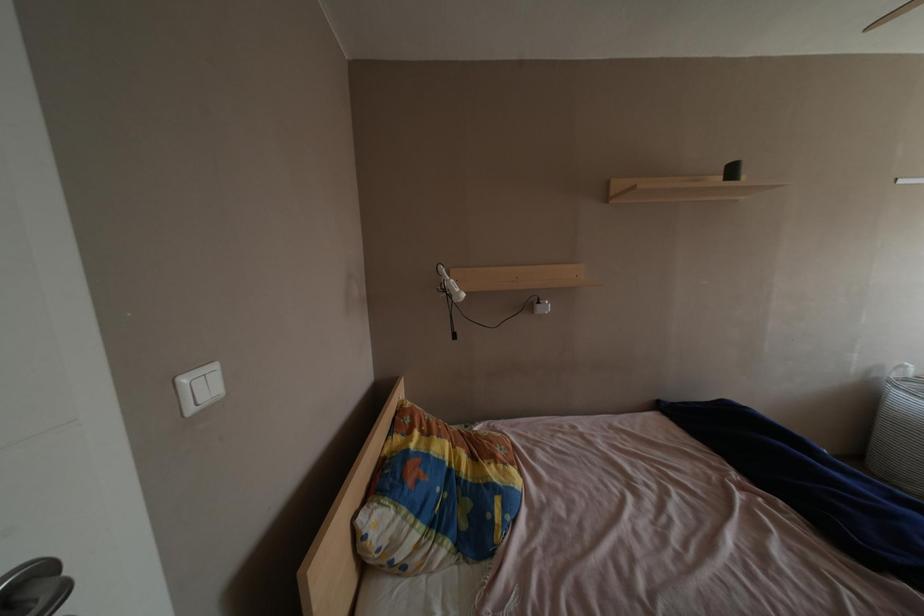
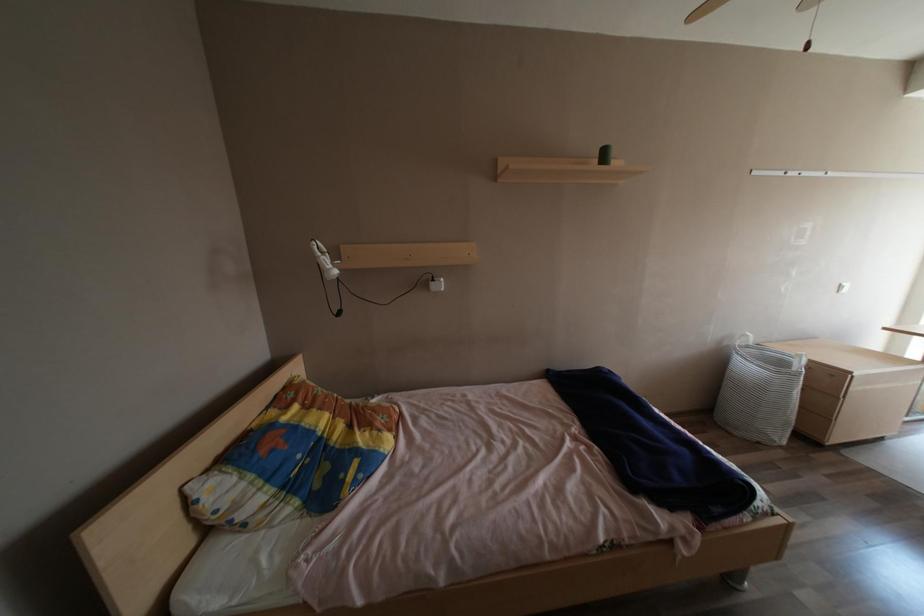
Question: The camera is either moving clockwise (left) or counter-clockwise (right) around the object. The first image is from the beginning of the video and the second image is from the end. Is the camera moving left or right when shooting the video?

Choices:
 (A) Left
 (B) Right

Answer: (A)